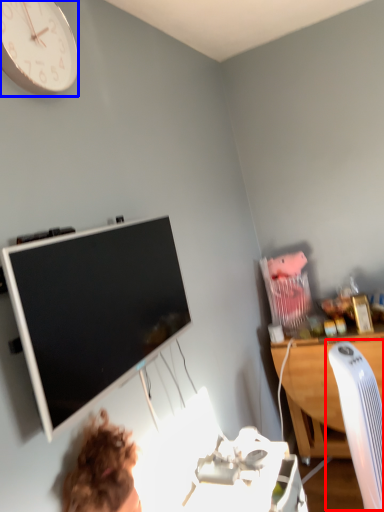
Question: Among these objects, which one is farthest to the camera, computer chair (highlighted by a red box) or wall clock (highlighted by a blue box)?

Choices:
 (A) computer chair
 (B) wall clock

Answer: (A)